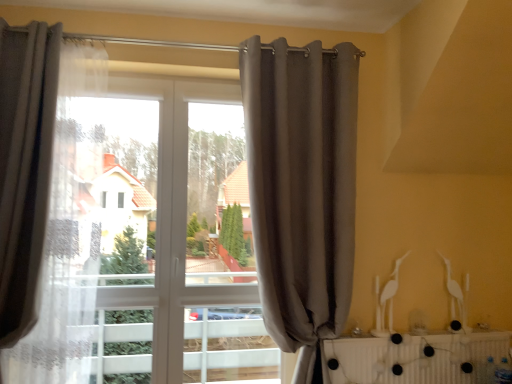
Question: From a real-world perspective, is white plastic radiator at lower right physically above gray fabric curtain at center, which is the second curtain in left-to-right order?

Choices:
 (A) no
 (B) yes

Answer: (A)

Question: Could you tell me if white plastic radiator at lower right is turned towards gray fabric curtain at center, which is the second curtain in left-to-right order?

Choices:
 (A) no
 (B) yes

Answer: (A)

Question: Does white plastic radiator at lower right have a larger size compared to gray fabric curtain at center, which is the second curtain in left-to-right order?

Choices:
 (A) no
 (B) yes

Answer: (A)

Question: From a real-world perspective, is white plastic radiator at lower right positioned under gray fabric curtain at center, positioned as the first curtain in right-to-left order, based on gravity?

Choices:
 (A) no
 (B) yes

Answer: (B)

Question: Does white plastic radiator at lower right have a lesser width compared to gray fabric curtain at center, positioned as the first curtain in right-to-left order?

Choices:
 (A) no
 (B) yes

Answer: (B)

Question: From the image's perspective, is gray fabric curtain at center, which is the second curtain in left-to-right order, located above or below matte gray curtain at left, which ranks as the 2th curtain in right-to-left order?

Choices:
 (A) above
 (B) below

Answer: (A)

Question: Is gray fabric curtain at center, which is the second curtain in left-to-right order, spatially inside matte gray curtain at left, which ranks as the 2th curtain in right-to-left order, or outside of it?

Choices:
 (A) inside
 (B) outside

Answer: (B)

Question: Is gray fabric curtain at center, which is the second curtain in left-to-right order, wider or thinner than matte gray curtain at left, which ranks as the 2th curtain in right-to-left order?

Choices:
 (A) thin
 (B) wide

Answer: (A)

Question: From their relative heights in the image, would you say gray fabric curtain at center, which is the second curtain in left-to-right order, is taller or shorter than matte gray curtain at left, which ranks as the 2th curtain in right-to-left order?

Choices:
 (A) short
 (B) tall

Answer: (B)

Question: In the image, is white plastic radiator at lower right positioned in front of or behind matte gray curtain at left, which ranks as the 2th curtain in right-to-left order?

Choices:
 (A) behind
 (B) front

Answer: (A)

Question: Visually, is white plastic radiator at lower right positioned to the left or to the right of matte gray curtain at left, which ranks as the 2th curtain in right-to-left order?

Choices:
 (A) right
 (B) left

Answer: (A)

Question: Is white plastic radiator at lower right bigger or smaller than matte gray curtain at left, placed as the first curtain when sorted from left to right?

Choices:
 (A) small
 (B) big

Answer: (A)

Question: Do you think white plastic radiator at lower right is within matte gray curtain at left, placed as the first curtain when sorted from left to right, or outside of it?

Choices:
 (A) inside
 (B) outside

Answer: (B)

Question: From the image's perspective, relative to white plastic radiator at lower right, is gray fabric curtain at center, which is the second curtain in left-to-right order, above or below?

Choices:
 (A) above
 (B) below

Answer: (A)

Question: Choose the correct answer: Is gray fabric curtain at center, which is the second curtain in left-to-right order, inside white plastic radiator at lower right or outside it?

Choices:
 (A) outside
 (B) inside

Answer: (A)